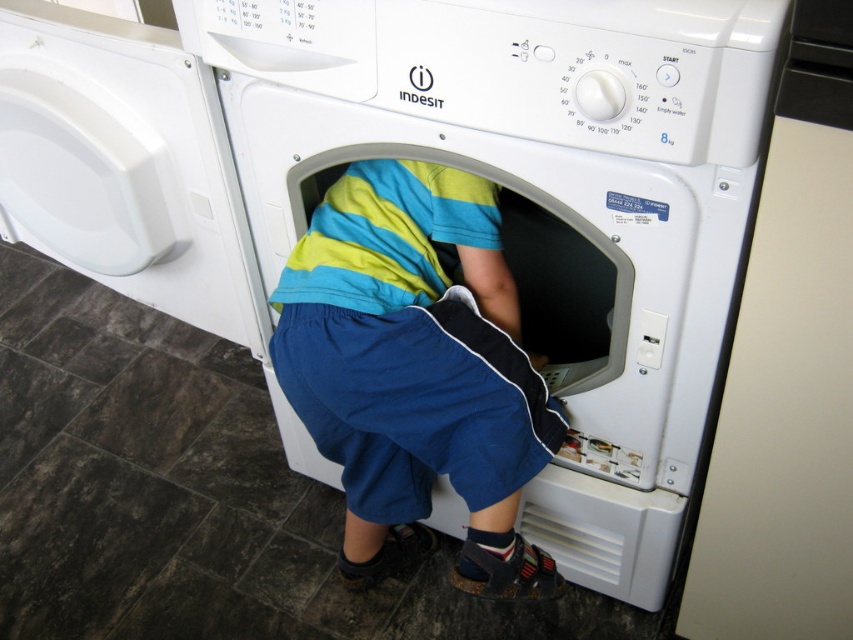
You are a technician inspecting the washing machine. You notice two points on the machine. The first point is at coordinates point [218,74] and the second point is at coordinates point [335,189]. Which point is closer to your current position?

Point [218,74] is closer to the camera than point [335,189], so the first point is closer to your current position.

You are a safety inspector in a daycare center. You see a white plastic washing machine at center and blue cotton shorts at center. According to safety guidelines, all washing machines must be placed at least 1 meter away from any clothing items to prevent accidental entanglement. Are these two items positioned safely?

The white plastic washing machine at center is positioned on the right side of blue cotton shorts at center. Since the description does not provide the distance between them, we cannot confirm if they are at least 1 meter apart. Safety guidelines require a minimum distance of 1 meter, so further measurement is needed to ensure compliance.